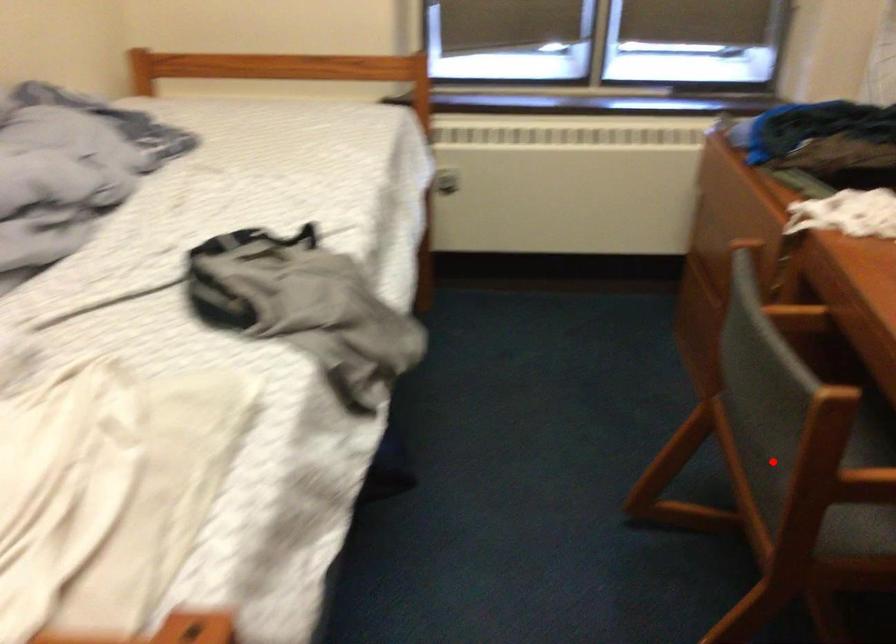
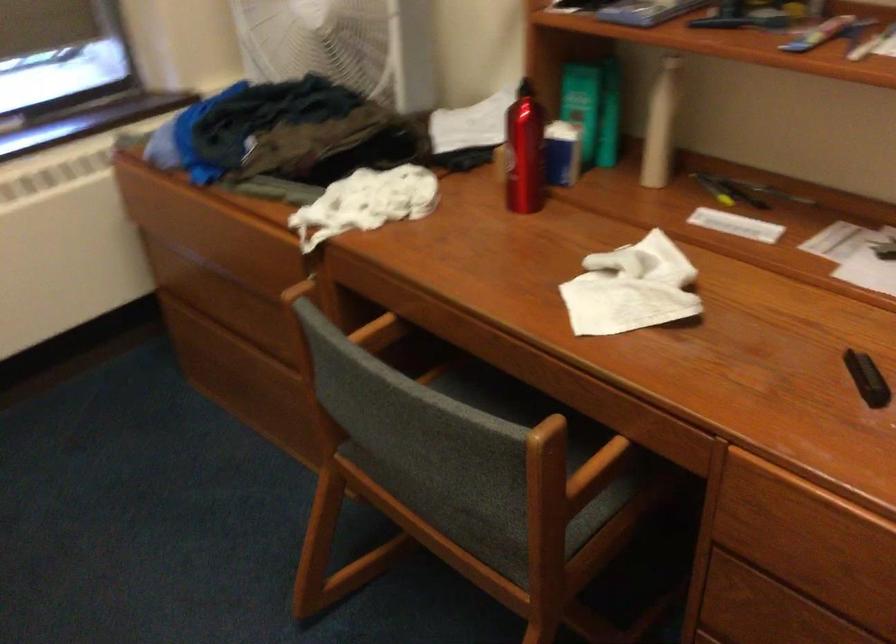
In the second image, find the point that corresponds to the highlighted location in the first image.

(488, 509)